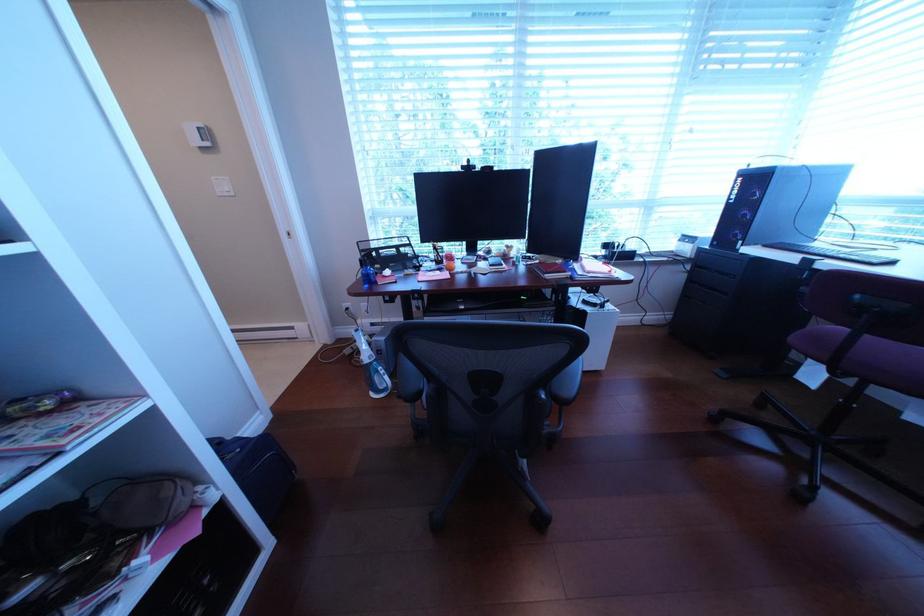
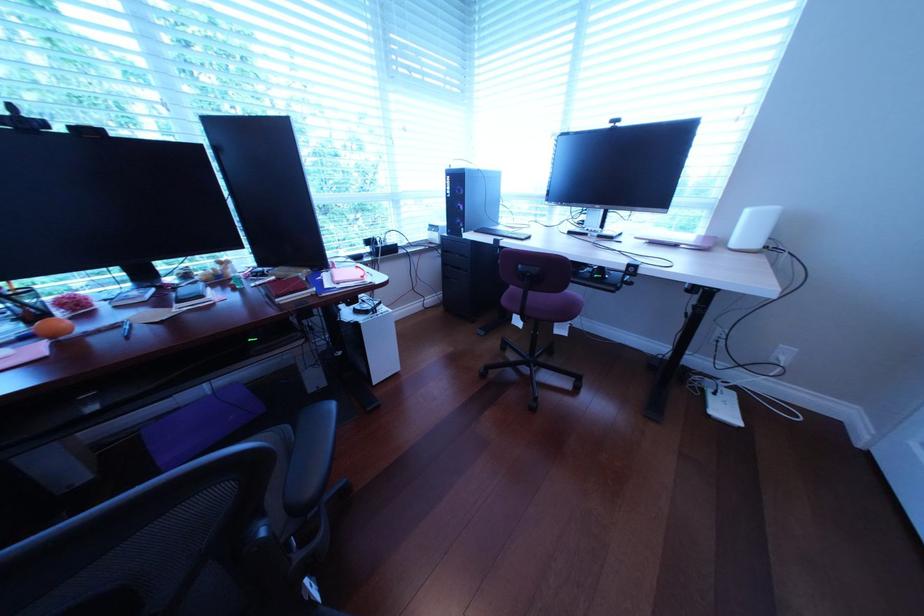
Question: Based on the continuous images, in which direction is the camera rotating? Reply with the corresponding letter.

Choices:
 (A) Left
 (B) Right
 (C) Up
 (D) Down

Answer: (B)